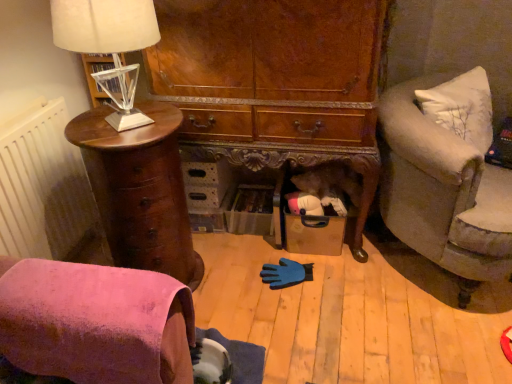
Describe the element at coordinates (95, 322) in the screenshot. I see `pink suede chair at lower left` at that location.

What is the approximate height of white fabric lampshade at left?

white fabric lampshade at left is 15.77 inches in height.

The image size is (512, 384). Describe the element at coordinates (140, 190) in the screenshot. I see `mahogany wood chest of drawers at left` at that location.

Describe the element at coordinates (45, 188) in the screenshot. I see `white textured radiator at left` at that location.

I want to click on velvet gray couch at right, so click(443, 192).

Which is behind, point (42, 196) or point (37, 325)?

Positioned behind is point (42, 196).

Does white textured radiator at left come behind pink suede chair at lower left?

Yes, white textured radiator at left is further from the viewer.

This screenshot has height=384, width=512. Find the location of `chair above the white textured radiator at left (from a real-world perspective)`. chair above the white textured radiator at left (from a real-world perspective) is located at coordinates (95, 322).

Considering the sizes of white textured radiator at left and pink suede chair at lower left in the image, is white textured radiator at left wider or thinner than pink suede chair at lower left?

Considering their sizes, white textured radiator at left looks slimmer than pink suede chair at lower left.

From the image's perspective, which one is positioned lower, pink suede chair at lower left or velvet gray couch at right?

pink suede chair at lower left appears lower in the image.

Is pink suede chair at lower left facing towards velvet gray couch at right?

No, pink suede chair at lower left is not facing towards velvet gray couch at right.

Between pink suede chair at lower left and velvet gray couch at right, which one has smaller size?

With smaller size is pink suede chair at lower left.

Considering the points (24, 363) and (456, 135), which point is behind, point (24, 363) or point (456, 135)?

The point (456, 135) is farther.

From the image's perspective, is white textured radiator at left under mahogany wood chest of drawers at left?

Actually, white textured radiator at left appears above mahogany wood chest of drawers at left in the image.

Looking at this image, is white textured radiator at left completely or partially outside of mahogany wood chest of drawers at left?

Yes.

From a real-world perspective, is white textured radiator at left positioned above or below mahogany wood chest of drawers at left?

white textured radiator at left is above mahogany wood chest of drawers at left.

The height and width of the screenshot is (384, 512). I want to click on the chest of drawers behind the pink suede chair at lower left, so click(x=140, y=190).

Does pink suede chair at lower left contain mahogany wood chest of drawers at left?

No, mahogany wood chest of drawers at left is not inside pink suede chair at lower left.

Are pink suede chair at lower left and mahogany wood chest of drawers at left making contact?

pink suede chair at lower left and mahogany wood chest of drawers at left are clearly separated.

From a real-world perspective, which object rests below the other?

mahogany wood chest of drawers at left is physically lower.

Can you tell me how much velvet gray couch at right and white textured radiator at left differ in facing direction?

The angular difference between velvet gray couch at right and white textured radiator at left is 44.5 degrees.

Which point is more forward, (450, 161) or (17, 203)?

The point (450, 161) is closer to the camera.

Looking at their sizes, would you say velvet gray couch at right is wider or thinner than white textured radiator at left?

velvet gray couch at right is wider than white textured radiator at left.

Find the location of a particular element. This screenshot has width=512, height=384. chest of drawers that appears on the right of white fabric lampshade at left is located at coordinates (x=140, y=190).

Does point (120, 132) come closer to viewer compared to point (123, 101)?

Yes, it is.

Is mahogany wood chest of drawers at left beside white fabric lampshade at left?

No, mahogany wood chest of drawers at left is not beside white fabric lampshade at left.

Identify the location of studio couch on the right of white fabric lampshade at left. Image resolution: width=512 pixels, height=384 pixels. (443, 192).

How many degrees apart are the facing directions of velvet gray couch at right and white fabric lampshade at left?

The facing directions of velvet gray couch at right and white fabric lampshade at left are 44.3 degrees apart.

Is point (420, 219) positioned after point (73, 7)?

That is True.

Find the location of `radiator that appears behind the pink suede chair at lower left`. radiator that appears behind the pink suede chair at lower left is located at coordinates (45, 188).

Where is `chair on the left of velvet gray couch at right`? Image resolution: width=512 pixels, height=384 pixels. chair on the left of velvet gray couch at right is located at coordinates (95, 322).

From the image, which object appears to be farther from pink suede chair at lower left, white fabric lampshade at left or velvet gray couch at right?

velvet gray couch at right is further to pink suede chair at lower left.

Which object lies nearer to the anchor point mahogany wood chest of drawers at left, velvet gray couch at right or white fabric lampshade at left?

white fabric lampshade at left lies closer to mahogany wood chest of drawers at left than the other object.

From the image, which object appears to be farther from pink suede chair at lower left, white fabric lampshade at left or mahogany wood chest of drawers at left?

white fabric lampshade at left lies further to pink suede chair at lower left than the other object.

Estimate the real-world distances between objects in this image. Which object is further from mahogany wood chest of drawers at left, white fabric lampshade at left or white textured radiator at left?

white fabric lampshade at left is further to mahogany wood chest of drawers at left.

From the image, which object appears to be farther from white textured radiator at left, pink suede chair at lower left or mahogany wood chest of drawers at left?

pink suede chair at lower left is further to white textured radiator at left.

When comparing their distances from mahogany wood chest of drawers at left, does pink suede chair at lower left or white textured radiator at left seem further?

The object further to mahogany wood chest of drawers at left is pink suede chair at lower left.

Consider the image. Estimate the real-world distances between objects in this image. Which object is closer to velvet gray couch at right, white fabric lampshade at left or white textured radiator at left?

white fabric lampshade at left is closer to velvet gray couch at right.

From the image, which object appears to be nearer to white textured radiator at left, white fabric lampshade at left or mahogany wood chest of drawers at left?

mahogany wood chest of drawers at left lies closer to white textured radiator at left than the other object.

Locate an element on the screen. The height and width of the screenshot is (384, 512). radiator between white fabric lampshade at left and pink suede chair at lower left in the vertical direction is located at coordinates (45, 188).

Where is `radiator located between pink suede chair at lower left and mahogany wood chest of drawers at left in the depth direction`? The image size is (512, 384). radiator located between pink suede chair at lower left and mahogany wood chest of drawers at left in the depth direction is located at coordinates (45, 188).

Where is `chair between white fabric lampshade at left and velvet gray couch at right in the horizontal direction`? This screenshot has width=512, height=384. chair between white fabric lampshade at left and velvet gray couch at right in the horizontal direction is located at coordinates (95, 322).

What are the coordinates of `chair situated between white textured radiator at left and velvet gray couch at right from left to right` in the screenshot? It's located at (95, 322).